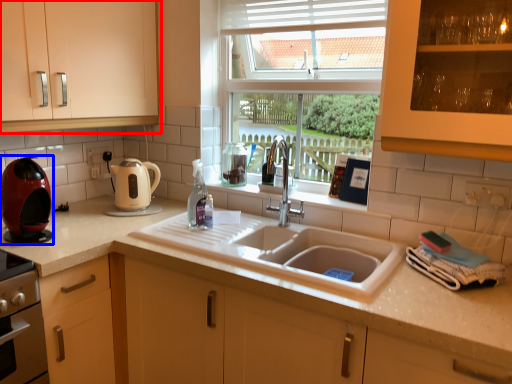
Question: Which of the following is the closest to the observer, cabinetry (highlighted by a red box) or kitchen appliance (highlighted by a blue box)?

Choices:
 (A) cabinetry
 (B) kitchen appliance

Answer: (A)